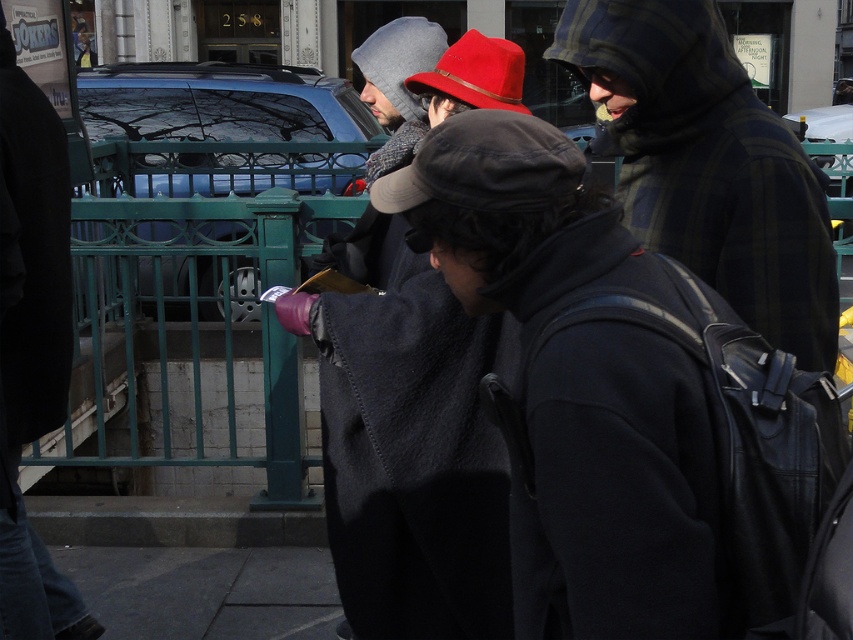
Question: Is matte black coat at center to the right of dark gray concrete pavement at lower center from the viewer's perspective?

Choices:
 (A) no
 (B) yes

Answer: (A)

Question: From the image, what is the correct spatial relationship of dark gray fabric cap at center in relation to red felt hat at center?

Choices:
 (A) below
 (B) above

Answer: (A)

Question: Which point is farther to the camera?

Choices:
 (A) dark gray concrete pavement at lower center
 (B) dark gray fabric cap at center
 (C) red felt hat at center
 (D) plaid woolen jacket at center

Answer: (A)

Question: Which object is the farthest from the dark gray concrete pavement at lower center?

Choices:
 (A) red felt hat at center
 (B) matte black coat at center
 (C) dark gray fabric cap at center
 (D) plaid woolen jacket at center

Answer: (C)

Question: Which object is positioned closest to the matte black coat at center?

Choices:
 (A) red felt hat at center
 (B) dark gray fabric cap at center

Answer: (A)

Question: Can you confirm if dark gray fabric cap at center is wider than red felt hat at center?

Choices:
 (A) no
 (B) yes

Answer: (B)